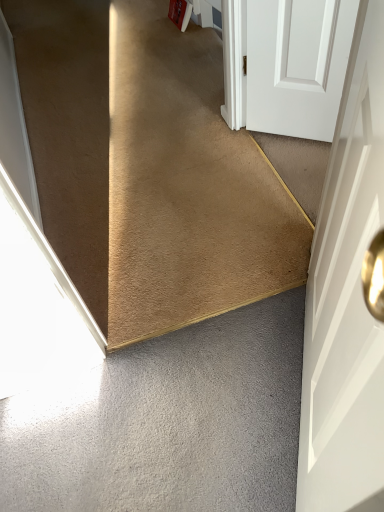
Question: Is the position of carpet at center less distant than that of white matte door at right?

Choices:
 (A) no
 (B) yes

Answer: (A)

Question: From a real-world perspective, does carpet at center sit lower than white matte door at right?

Choices:
 (A) no
 (B) yes

Answer: (B)

Question: Does carpet at center have a greater height compared to white matte door at right?

Choices:
 (A) yes
 (B) no

Answer: (B)

Question: Is carpet at center oriented towards white matte door at right?

Choices:
 (A) no
 (B) yes

Answer: (A)

Question: Does carpet at center have a lesser width compared to white matte door at right?

Choices:
 (A) no
 (B) yes

Answer: (A)

Question: Can we say carpet at center lies outside white matte door at right?

Choices:
 (A) no
 (B) yes

Answer: (B)

Question: Are white matte door at right and carpet at center making contact?

Choices:
 (A) no
 (B) yes

Answer: (A)

Question: Does white matte door at right come behind carpet at center?

Choices:
 (A) no
 (B) yes

Answer: (A)

Question: From the image's perspective, does white matte door at right appear lower than carpet at center?

Choices:
 (A) yes
 (B) no

Answer: (A)

Question: Can you confirm if white matte door at right is smaller than carpet at center?

Choices:
 (A) yes
 (B) no

Answer: (A)

Question: Does white matte door at right have a lesser width compared to carpet at center?

Choices:
 (A) yes
 (B) no

Answer: (A)

Question: Is white matte door at right oriented away from carpet at center?

Choices:
 (A) yes
 (B) no

Answer: (B)

Question: From the image's perspective, would you say carpet at center is shown under gray matte concrete at lower left?

Choices:
 (A) yes
 (B) no

Answer: (B)